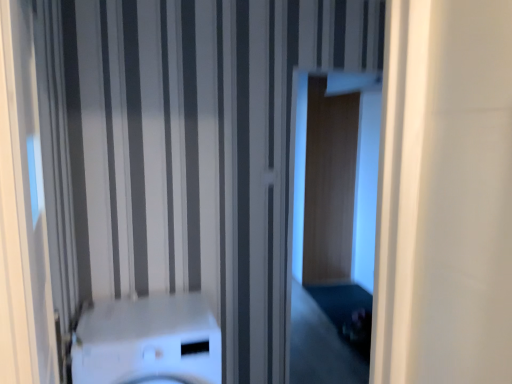
Question: Can you confirm if white glossy washer at center is smaller than transparent glass door at center?

Choices:
 (A) no
 (B) yes

Answer: (B)

Question: Is transparent glass door at center located within white glossy washer at center?

Choices:
 (A) no
 (B) yes

Answer: (A)

Question: Is the depth of white glossy washer at center less than that of transparent glass door at center?

Choices:
 (A) yes
 (B) no

Answer: (A)

Question: Is white glossy washer at center thinner than transparent glass door at center?

Choices:
 (A) yes
 (B) no

Answer: (B)

Question: From the image's perspective, is white glossy washer at center located beneath transparent glass door at center?

Choices:
 (A) yes
 (B) no

Answer: (A)

Question: Is white glossy washer at center facing towards transparent glass door at center?

Choices:
 (A) yes
 (B) no

Answer: (B)

Question: From the image's perspective, would you say transparent glass door at center is positioned over white glossy washer at center?

Choices:
 (A) yes
 (B) no

Answer: (A)

Question: Does transparent glass door at center appear on the right side of white glossy washer at center?

Choices:
 (A) yes
 (B) no

Answer: (A)

Question: From a real-world perspective, is transparent glass door at center located beneath white glossy washer at center?

Choices:
 (A) no
 (B) yes

Answer: (A)

Question: Can you see transparent glass door at center touching white glossy washer at center?

Choices:
 (A) yes
 (B) no

Answer: (B)

Question: Could you tell me if transparent glass door at center is turned towards white glossy washer at center?

Choices:
 (A) yes
 (B) no

Answer: (B)

Question: From the image's perspective, is transparent glass door at center beneath white glossy washer at center?

Choices:
 (A) yes
 (B) no

Answer: (B)

Question: From a real-world perspective, is transparent glass door at center physically located above or below white glossy washer at center?

Choices:
 (A) below
 (B) above

Answer: (B)